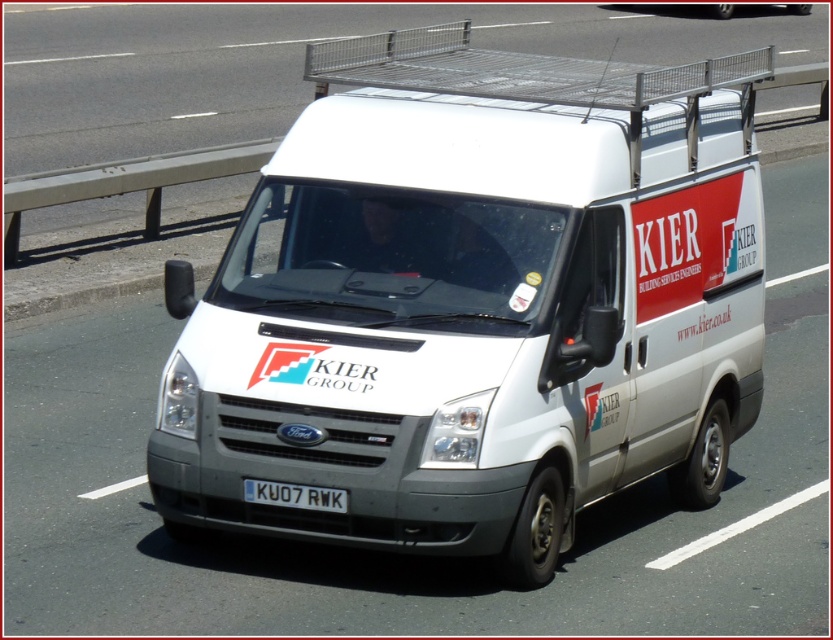
Is point (328, 284) in front of point (589, 6)?

Yes, it is.

The width and height of the screenshot is (833, 640). I want to click on white matte van at center, so click(474, 301).

In order to click on white matte van at center in this screenshot , I will do `click(474, 301)`.

Which of these two, white matte van at center or white plastic license plate at center, stands taller?

white matte van at center

Between white matte van at center and white plastic license plate at center, which one is positioned lower?

white plastic license plate at center

Is point (656, 196) closer to viewer compared to point (247, 499)?

No, (656, 196) is behind (247, 499).

The width and height of the screenshot is (833, 640). I want to click on white matte van at center, so click(x=474, y=301).

Is white van at center wider than white plastic license plate at center?

Indeed, white van at center has a greater width compared to white plastic license plate at center.

Does white van at center appear on the left side of white plastic license plate at center?

Indeed, white van at center is positioned on the left side of white plastic license plate at center.

What do you see at coordinates (290, 61) in the screenshot? This screenshot has height=640, width=833. I see `white van at center` at bounding box center [290, 61].

I want to click on white van at center, so click(x=290, y=61).